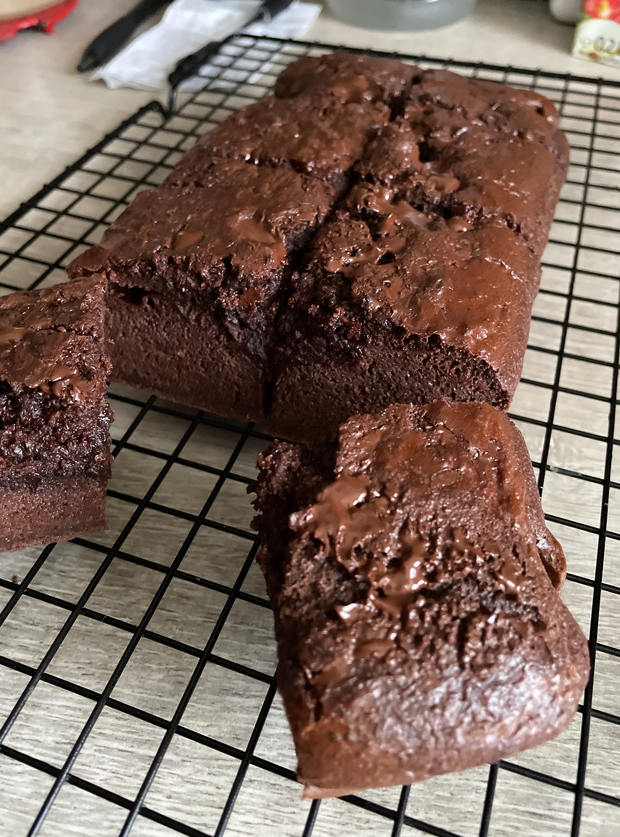
Locate an element on the screen. clear bowl is located at coordinates pos(407,16), pos(371,16).